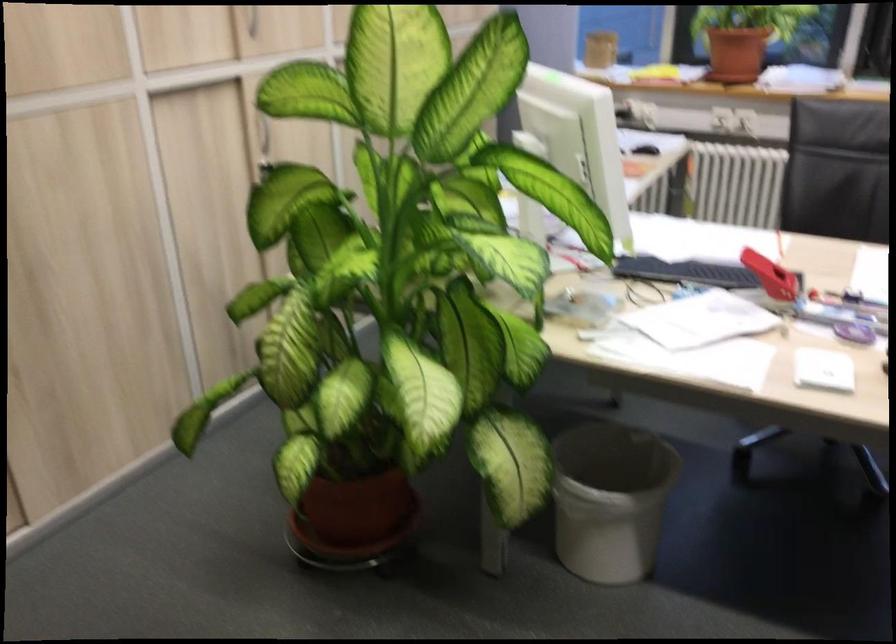
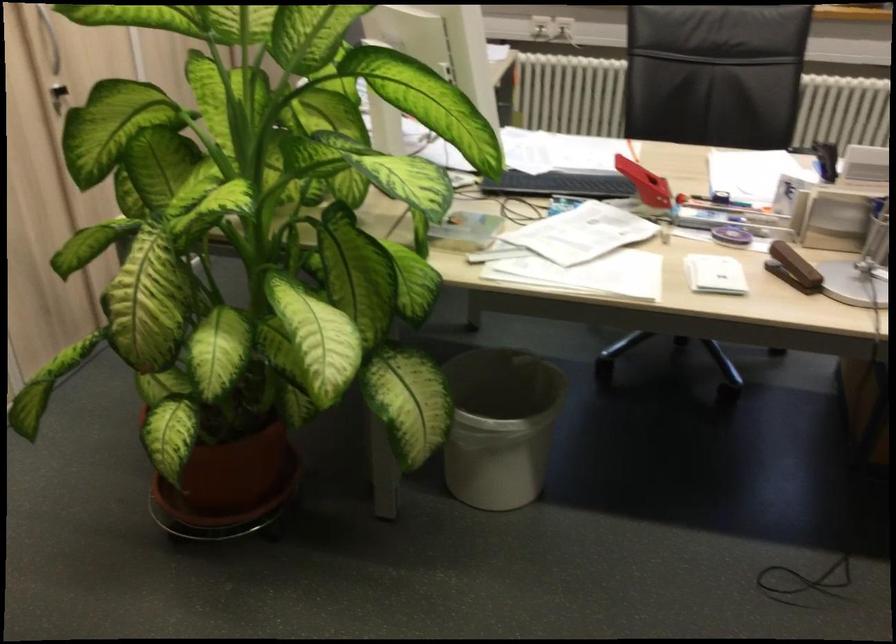
Find the pixel in the second image that matches (348,522) in the first image.

(228, 487)